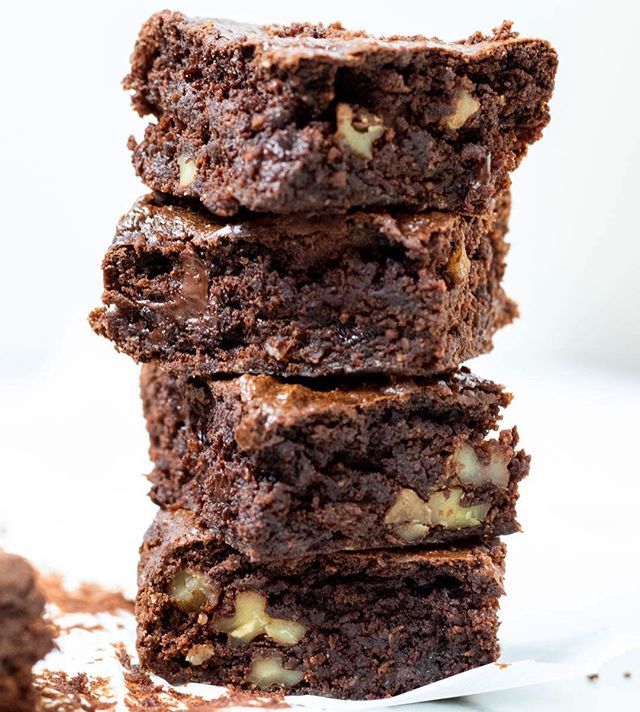
Identify the location of white surface. (545, 696).